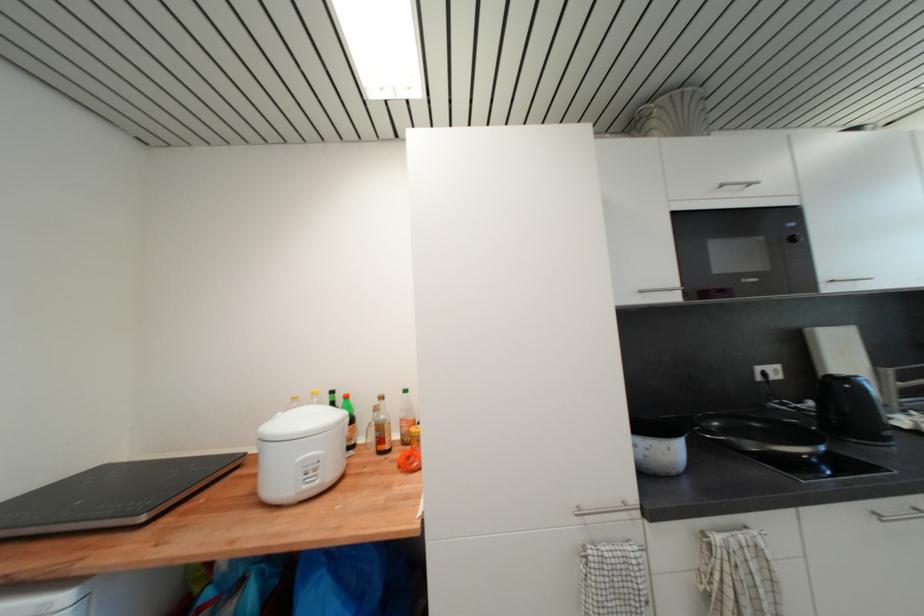
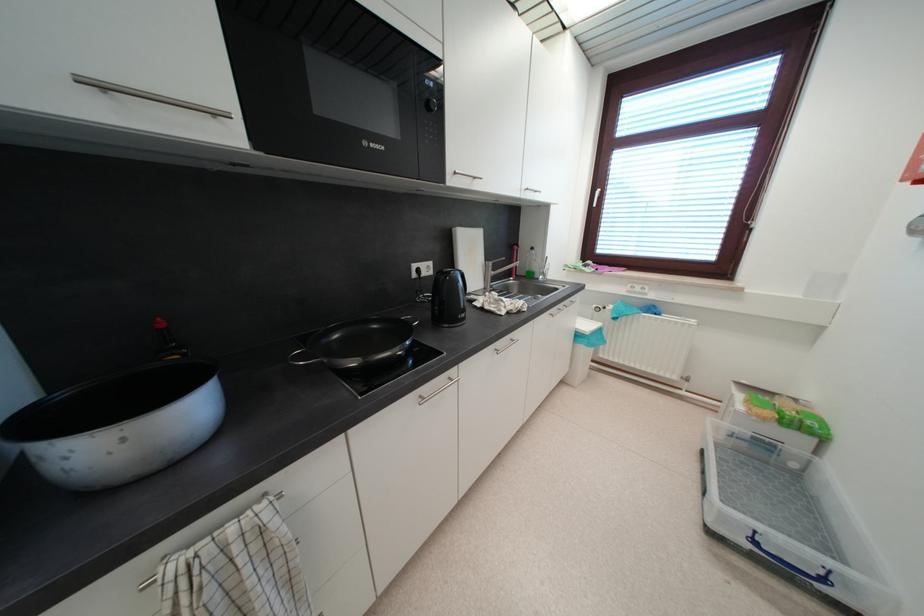
Find the pixel in the second image that matches (870,392) in the first image.

(464, 284)